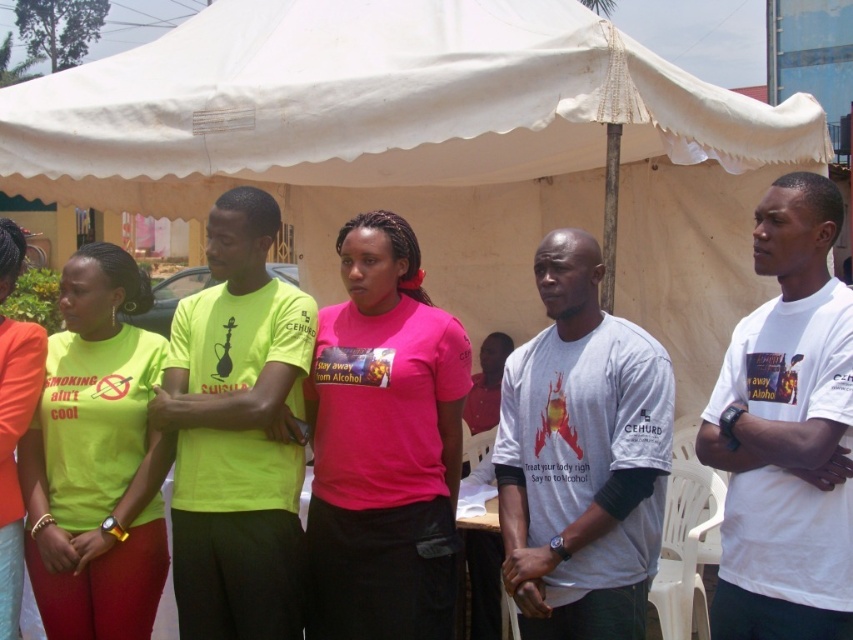
Question: Does pink matte shirt at center have a larger size compared to white matte t-shirt at center?

Choices:
 (A) yes
 (B) no

Answer: (A)

Question: Which is nearer to the matte green t-shirt at left?

Choices:
 (A) white matte shirt at center
 (B) white matte t-shirt at center
 (C) neon yellow t-shirt at center

Answer: (C)

Question: Which of these objects is positioned closest to the neon yellow t-shirt at left?

Choices:
 (A) pink matte shirt at center
 (B) white matte shirt at center

Answer: (A)

Question: Can you confirm if pink matte shirt at center is positioned to the left of matte green t-shirt at left?

Choices:
 (A) yes
 (B) no

Answer: (B)

Question: Which of these objects is positioned farthest from the neon yellow t-shirt at center?

Choices:
 (A) neon yellow t-shirt at left
 (B) pink matte shirt at center

Answer: (A)

Question: Is pink matte shirt at center wider than neon yellow t-shirt at center?

Choices:
 (A) no
 (B) yes

Answer: (A)